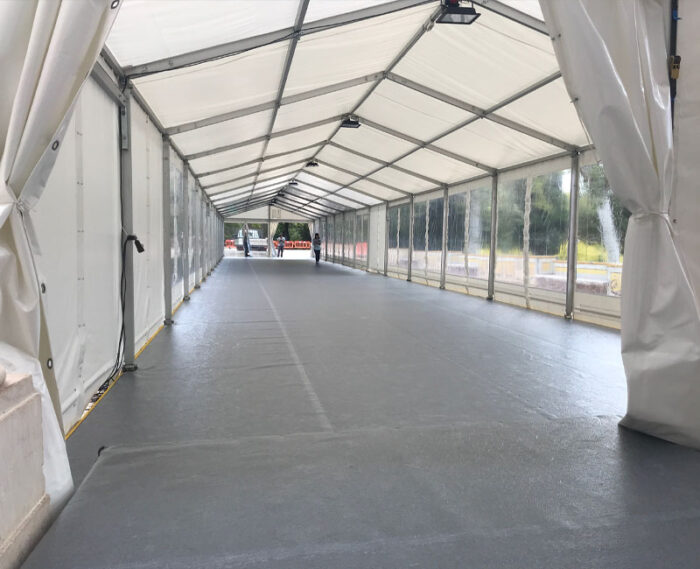
Locate an element on the screen. The height and width of the screenshot is (569, 700). pulled back canvas drape is located at coordinates (42, 109), (628, 123).